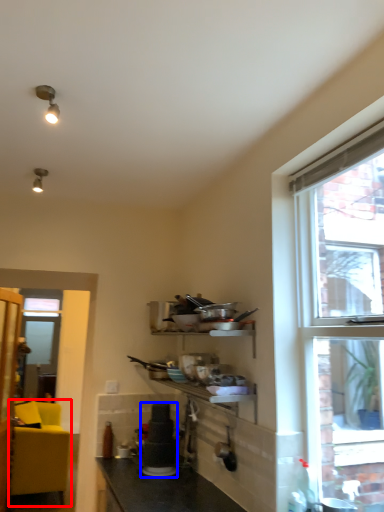
Question: Which of the following is the farthest to the observer, studio couch (highlighted by a red box) or appliance (highlighted by a blue box)?

Choices:
 (A) studio couch
 (B) appliance

Answer: (A)